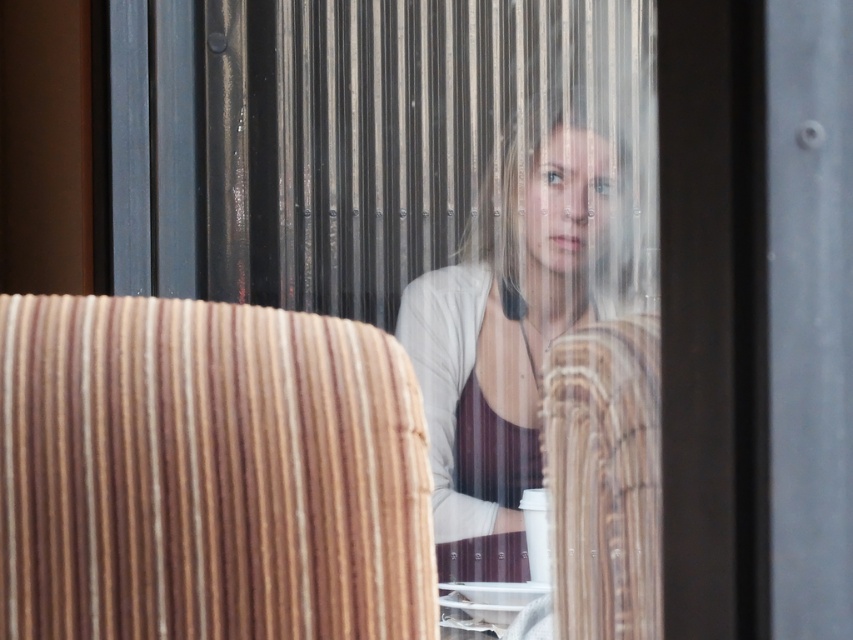
Question: Is wooden ribbed armchair at center bigger than matte white shirt at center?

Choices:
 (A) yes
 (B) no

Answer: (B)

Question: Considering the relative positions of matte white shirt at center and wooden armchair at center in the image provided, where is matte white shirt at center located with respect to wooden armchair at center?

Choices:
 (A) right
 (B) left

Answer: (B)

Question: Which of the following is the closest to the observer?

Choices:
 (A) tap(490, 230)
 (B) tap(286, 390)

Answer: (B)

Question: Considering the real-world distances, which object is farthest from the wooden ribbed armchair at center?

Choices:
 (A) matte white shirt at center
 (B) wooden armchair at center

Answer: (A)

Question: Does wooden ribbed armchair at center have a lesser width compared to wooden armchair at center?

Choices:
 (A) no
 (B) yes

Answer: (A)

Question: Which point appears closest to the camera in this image?

Choices:
 (A) (251, 556)
 (B) (477, 538)
 (C) (622, 464)

Answer: (A)